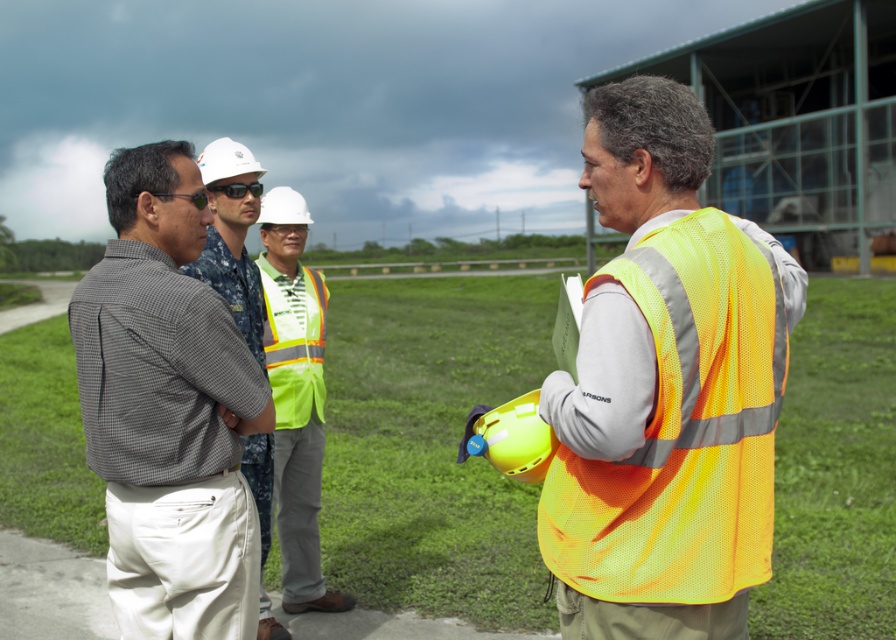
Question: Among these points, which one is farthest from the camera?

Choices:
 (A) (283, 381)
 (B) (169, 321)
 (C) (247, 260)

Answer: (A)

Question: Considering the real-world distances, which object is closest to the reflective yellow safety vest at center?

Choices:
 (A) neon yellow safety vest at center
 (B) matte gray shirt at center

Answer: (B)

Question: Is checkered shirt at left above matte gray shirt at center?

Choices:
 (A) yes
 (B) no

Answer: (A)

Question: Among these objects, which one is nearest to the camera?

Choices:
 (A) black plastic sunglasses at center
 (B) reflective yellow safety vest at center
 (C) neon yellow reflective safety vest at center
 (D) neon yellow safety vest at center

Answer: (D)

Question: Is reflective yellow safety vest at center above matte gray shirt at center?

Choices:
 (A) yes
 (B) no

Answer: (B)

Question: Does checkered shirt at left have a greater width compared to reflective yellow safety vest at center?

Choices:
 (A) yes
 (B) no

Answer: (A)